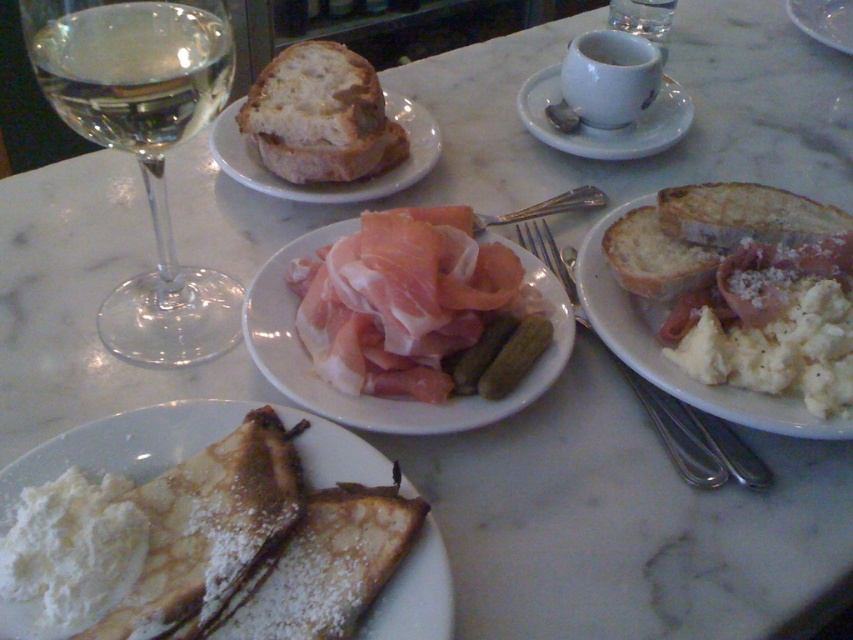
From the picture: You are a server at a restaurant and need to place a dessert plate between the transparent glass wine glass at left and another object. The dessert plate has a diameter of 10 inches. Can you fit it between them without touching either object?

The distance between the transparent glass wine glass at left and the other object is 15.67 inches. Since the dessert plate has a diameter of 10 inches, there is enough space to place it between them without touching either object.